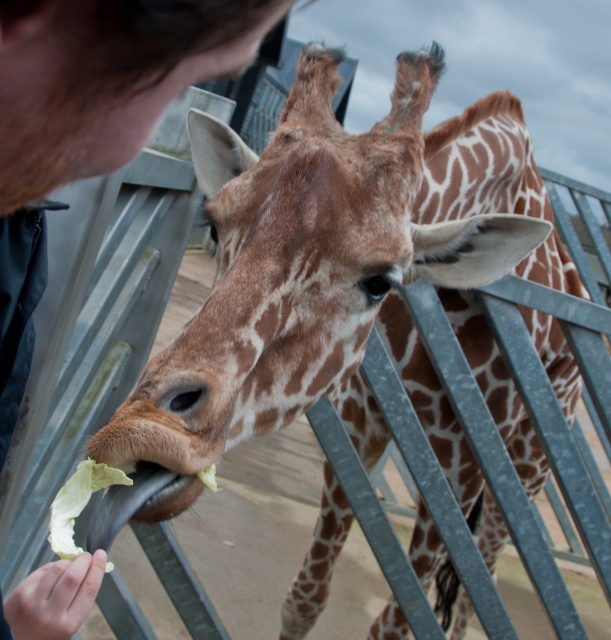
Question: Which point appears closest to the camera in this image?

Choices:
 (A) (276, 13)
 (B) (170, 472)
 (C) (93, 472)

Answer: (A)

Question: Which object appears farthest from the camera in this image?

Choices:
 (A) skinny white hand at lower left
 (B) green leafy vegetable at lower left
 (C) soft brown fur at center
 (D) dark brown hair at upper left

Answer: (C)

Question: Does skinny white hand at lower left have a greater width compared to green leafy vegetable at lower left?

Choices:
 (A) no
 (B) yes

Answer: (B)

Question: Which object is the closest to the soft brown fur at center?

Choices:
 (A) skinny white hand at lower left
 (B) dark brown hair at upper left
 (C) green leafy vegetable at lower left

Answer: (C)

Question: Can you confirm if soft brown fur at center is thinner than green leafy vegetable at lower left?

Choices:
 (A) yes
 (B) no

Answer: (B)

Question: Can you confirm if dark brown hair at upper left is smaller than green leafy vegetable at lower left?

Choices:
 (A) no
 (B) yes

Answer: (A)